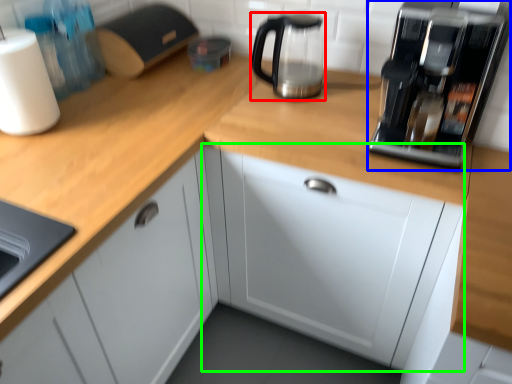
Question: Considering the real-world distances, which object is closest to kitchen appliance (highlighted by a red box)? home appliance (highlighted by a blue box) or cabinetry (highlighted by a green box).

Choices:
 (A) home appliance
 (B) cabinetry

Answer: (A)